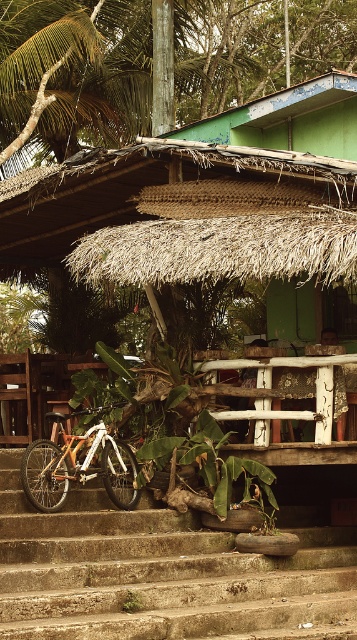
You are a delivery person carrying a package that is 3 meters long. You need to move it through the space between the thatched roof hut at center and the white wood balustrade at center. Is the space wide enough to fit the package without bending it?

The space between the thatched roof hut at center and the white wood balustrade at center is 2.54 meters. Since the package is 3 meters long, it is longer than the available space, so the package cannot fit without bending.

What are the coordinates of the thatched roof hut at center?

The coordinates of the thatched roof hut at center are at point (x=208, y=204).

You are standing at the bottom of the concrete stairs at lower center and want to place a 1.2 meter tall decoration on the white wood balustrade at center. Can the decoration be placed there without exceeding the balustrade height?

The concrete stairs at lower center has a lesser height compared to white wood balustrade at center. Since the stairs are shorter than the balustrade, the decoration can be placed on the white wood balustrade at center as long as its height does not exceed the balustrade.